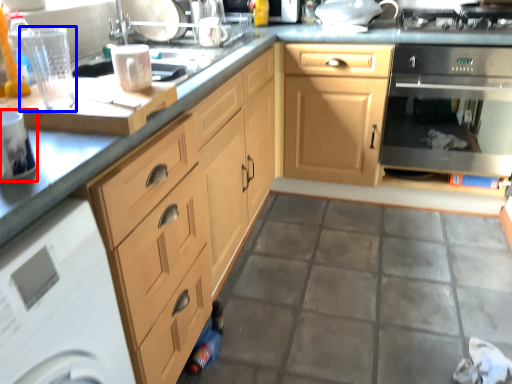
Question: Among these objects, which one is nearest to the camera, kitchen appliance (highlighted by a red box) or appliance (highlighted by a blue box)?

Choices:
 (A) kitchen appliance
 (B) appliance

Answer: (A)